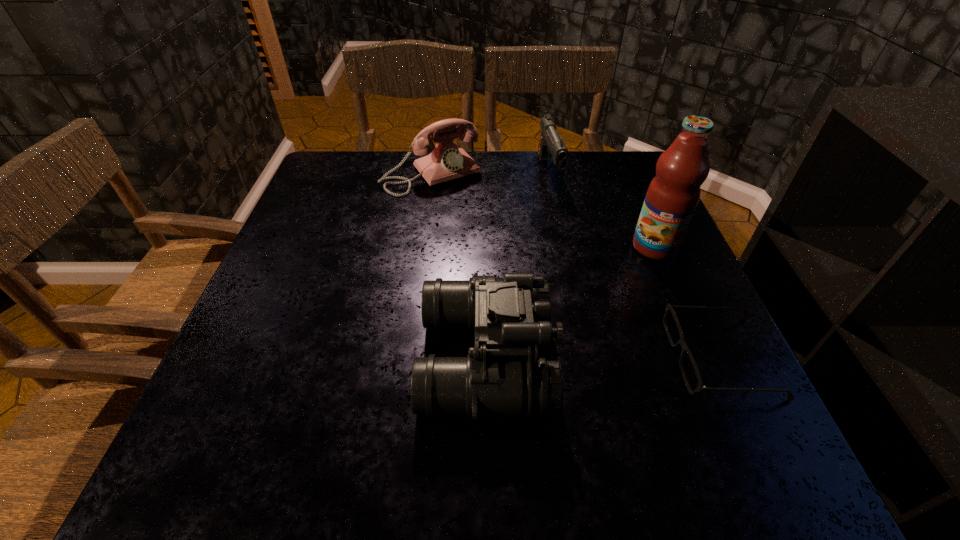
This screenshot has height=540, width=960. What are the coordinates of `gun that is at the far edge` in the screenshot? It's located at (550, 141).

You are a GUI agent. You are given a task and a screenshot of the screen. Output one action in this format:
    pyautogui.click(x=<x>, y=<y>)
    Task: Click on the binoculars present at the near edge
    
    Given the screenshot: What is the action you would take?
    pyautogui.click(x=508, y=379)

At what (x,y) coordinates should I click in order to perform the action: click on spectacles that is positioned at the near edge. Please return your answer as a coordinate pair (x, y). Looking at the image, I should click on (700, 387).

Identify the location of spectacles that is at the right edge. (700, 387).

Identify the location of fruit juice present at the right edge. (673, 194).

Where is `object situated at the near right corner`? This screenshot has height=540, width=960. object situated at the near right corner is located at coordinates [700, 387].

This screenshot has width=960, height=540. Identify the location of blank space at the far edge of the desktop. (569, 177).

The width and height of the screenshot is (960, 540). What are the coordinates of `vacant space at the near edge` in the screenshot? It's located at (654, 401).

This screenshot has width=960, height=540. What are the coordinates of `free region at the left edge of the desktop` in the screenshot? It's located at (305, 342).

The image size is (960, 540). I want to click on vacant space at the right edge of the desktop, so click(600, 222).